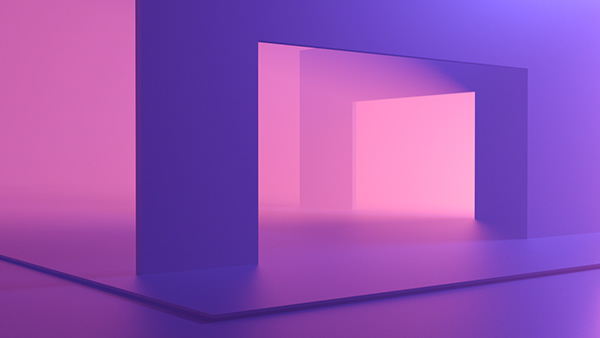
Identify the location of wall. (555, 183).